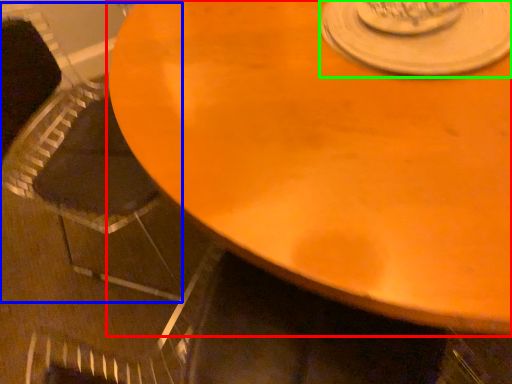
Question: Which is nearer to the table (highlighted by a red box)? armchair (highlighted by a blue box) or saucer (highlighted by a green box).

Choices:
 (A) armchair
 (B) saucer

Answer: (B)